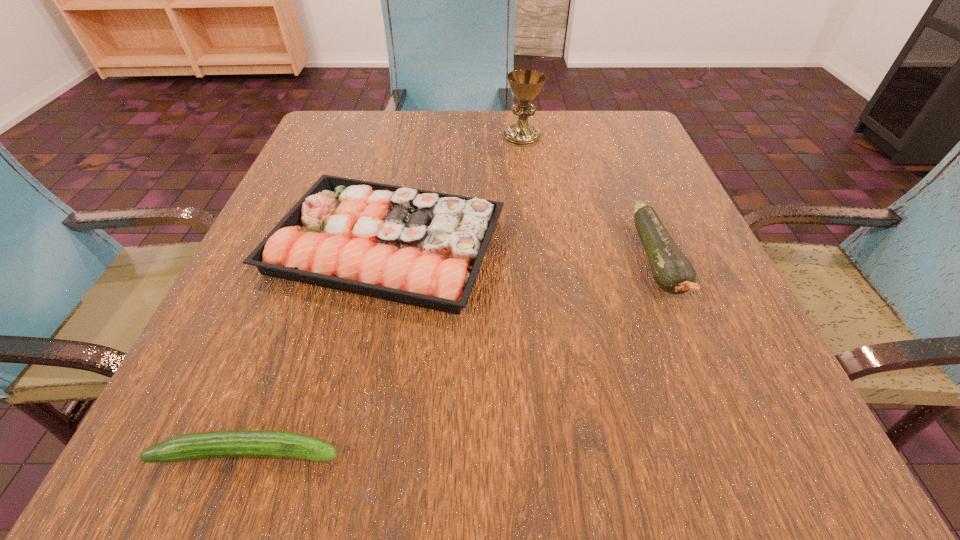
The image size is (960, 540). Find the location of `the farthest object`. the farthest object is located at coordinates [x=525, y=85].

In order to click on the tallest object in this screenshot , I will do `click(525, 85)`.

The height and width of the screenshot is (540, 960). I want to click on the taller zucchini, so click(x=673, y=272).

In order to click on the rightmost object in this screenshot , I will do `click(673, 272)`.

This screenshot has height=540, width=960. What are the coordinates of `platter` in the screenshot? It's located at (410, 246).

The width and height of the screenshot is (960, 540). I want to click on the left zucchini, so click(233, 443).

In order to click on the shorter zucchini in this screenshot , I will do `click(233, 443)`.

In order to click on vacant area situated on the front of the tallest object in this screenshot , I will do `click(528, 186)`.

This screenshot has height=540, width=960. I want to click on blank space located 0.110m at the blossom end of the right zucchini, so click(x=705, y=378).

I want to click on vacant space located 0.220m on the back of the platter, so click(411, 133).